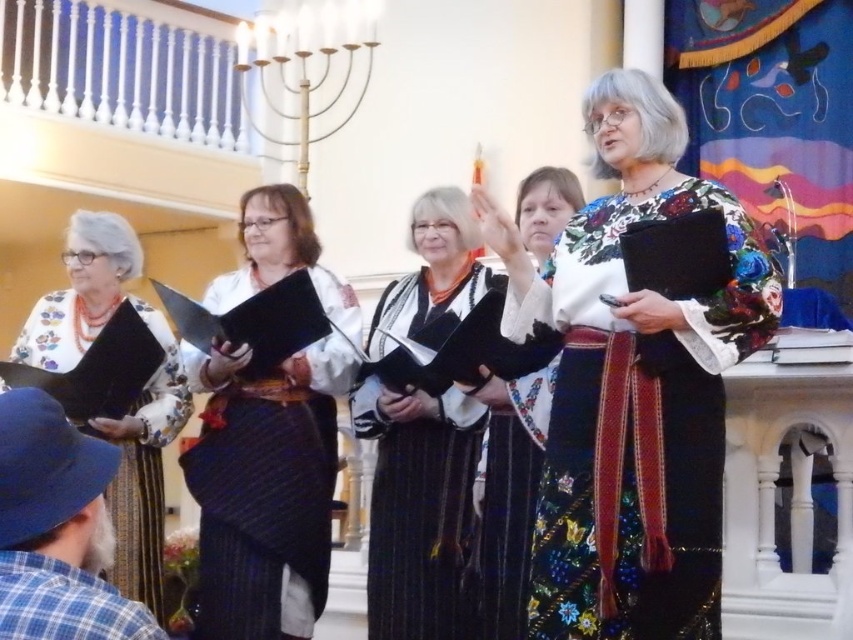
Question: In this image, where is floral-patterned fabric dress at center located relative to matte black book at lower left?

Choices:
 (A) above
 (B) below

Answer: (B)

Question: Can you confirm if floral-patterned fabric dress at center is positioned above black velvet robe at center?

Choices:
 (A) yes
 (B) no

Answer: (B)

Question: Which of these objects is positioned closest to the matte black book at center?

Choices:
 (A) floral-patterned fabric dress at center
 (B) black velvet robe at center
 (C) black paper at center
 (D) matte black book at lower left

Answer: (B)

Question: Which object appears closest to the camera in this image?

Choices:
 (A) blue plaid shirt at lower left
 (B) matte black book at center
 (C) black paper at center
 (D) matte black book at lower left

Answer: (A)

Question: Does floral-patterned fabric dress at center appear under matte black book at lower left?

Choices:
 (A) yes
 (B) no

Answer: (A)

Question: Among these objects, which one is farthest from the camera?

Choices:
 (A) matte black book at lower left
 (B) matte black book at center

Answer: (B)